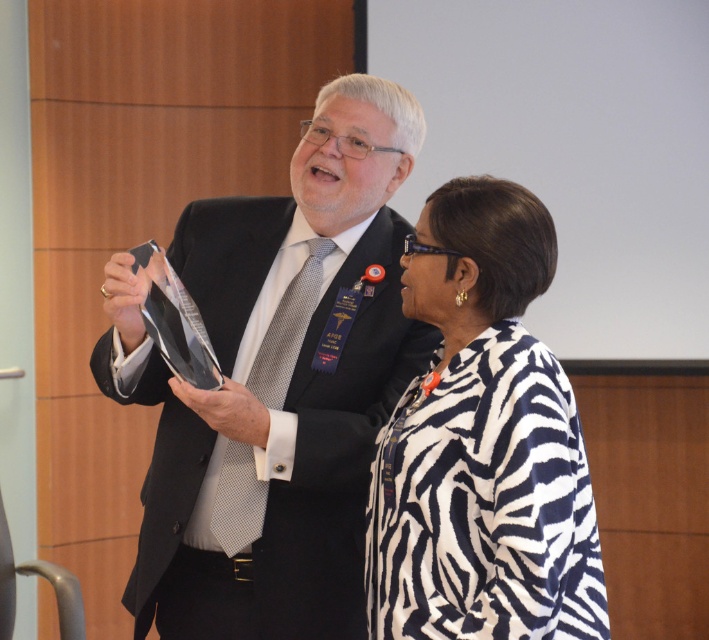
Measure the distance between zebra-patterned jacket at center-right and camera.

zebra-patterned jacket at center-right and camera are 5.62 feet apart.

Does zebra-patterned jacket at center-right have a larger size compared to gray dotted tie at center?

Correct, zebra-patterned jacket at center-right is larger in size than gray dotted tie at center.

Locate an element on the screen. zebra-patterned jacket at center-right is located at coordinates (481, 442).

Consider the image. Who is more forward, (233, 452) or (559, 554)?

Positioned in front is point (559, 554).

Can you confirm if matte black suit at center is shorter than zebra-patterned jacket at center-right?

No, matte black suit at center is not shorter than zebra-patterned jacket at center-right.

Is point (389, 221) farther from camera compared to point (374, 570)?

Yes.

Locate an element on the screen. matte black suit at center is located at coordinates (274, 385).

Can you confirm if matte black suit at center is shorter than gray dotted tie at center?

Incorrect, matte black suit at center's height does not fall short of gray dotted tie at center's.

Between point (325, 396) and point (262, 502), which one is positioned behind?

The point (325, 396) is behind.

You are a GUI agent. You are given a task and a screenshot of the screen. Output one action in this format:
    pyautogui.click(x=<x>, y=<y>)
    Task: Click on the matte black suit at center
    This screenshot has height=640, width=709.
    Given the screenshot: What is the action you would take?
    pyautogui.click(x=274, y=385)